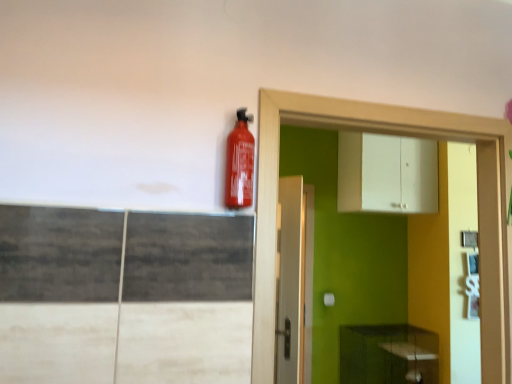
Question: From a real-world perspective, is matte red extinguisher at upper center on top of white matte cabinet at upper center, acting as the second cabinetry starting from the bottom?

Choices:
 (A) no
 (B) yes

Answer: (A)

Question: From the image's perspective, is matte red extinguisher at upper center located above white matte cabinet at upper center, which is the first cabinetry in top-to-bottom order?

Choices:
 (A) yes
 (B) no

Answer: (B)

Question: From the image's perspective, would you say matte red extinguisher at upper center is shown under white matte cabinet at upper center, which is the first cabinetry in top-to-bottom order?

Choices:
 (A) yes
 (B) no

Answer: (A)

Question: Does matte red extinguisher at upper center lie in front of white matte cabinet at upper center, acting as the second cabinetry starting from the bottom?

Choices:
 (A) no
 (B) yes

Answer: (B)

Question: Does matte red extinguisher at upper center come behind white matte cabinet at upper center, which is the first cabinetry in top-to-bottom order?

Choices:
 (A) no
 (B) yes

Answer: (A)

Question: Could you tell me if matte red extinguisher at upper center is facing white matte cabinet at upper center, which is the first cabinetry in top-to-bottom order?

Choices:
 (A) no
 (B) yes

Answer: (A)

Question: From a real-world perspective, is matte red extinguisher at upper center physically below white glossy dresser at upper right?

Choices:
 (A) yes
 (B) no

Answer: (B)

Question: From a real-world perspective, is matte red extinguisher at upper center physically above white glossy dresser at upper right?

Choices:
 (A) yes
 (B) no

Answer: (A)

Question: Would you say white glossy dresser at upper right is part of matte red extinguisher at upper center's contents?

Choices:
 (A) yes
 (B) no

Answer: (B)

Question: Can we say matte red extinguisher at upper center lies outside white glossy dresser at upper right?

Choices:
 (A) no
 (B) yes

Answer: (B)

Question: Considering the relative sizes of matte red extinguisher at upper center and white glossy dresser at upper right in the image provided, is matte red extinguisher at upper center smaller than white glossy dresser at upper right?

Choices:
 (A) no
 (B) yes

Answer: (B)

Question: Considering the relative sizes of matte red extinguisher at upper center and white glossy dresser at upper right in the image provided, is matte red extinguisher at upper center shorter than white glossy dresser at upper right?

Choices:
 (A) yes
 (B) no

Answer: (A)

Question: Is white glossy dresser at upper right inside green matte cabinet at lower right, which appears as the 1th cabinetry when ordered from the bottom?

Choices:
 (A) no
 (B) yes

Answer: (A)